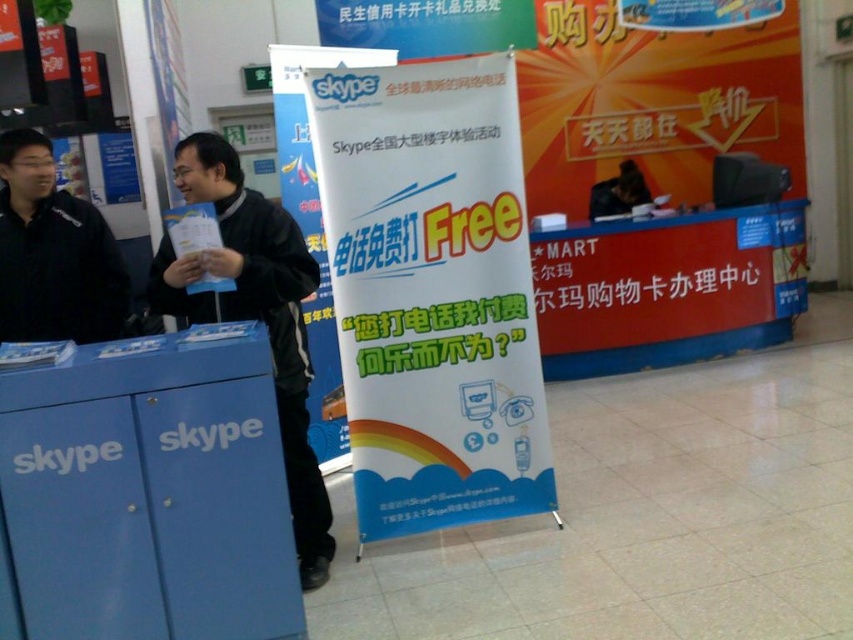
Question: Does red plastic sign at center have a smaller size compared to black matte jacket at left?

Choices:
 (A) yes
 (B) no

Answer: (B)

Question: Which object is the farthest from the white paper sign at center?

Choices:
 (A) blue matte skype cabinet at left
 (B) red plastic sign at center
 (C) black matte jacket at center
 (D) black matte jacket at left

Answer: (B)

Question: Based on their relative distances, which object is nearer to the black matte jacket at center?

Choices:
 (A) black matte jacket at left
 (B) red plastic sign at center

Answer: (A)

Question: Can you confirm if white paper sign at center is bigger than black matte jacket at center?

Choices:
 (A) yes
 (B) no

Answer: (A)

Question: Is blue matte skype cabinet at left to the left of black matte jacket at center from the viewer's perspective?

Choices:
 (A) yes
 (B) no

Answer: (A)

Question: Among these points, which one is nearest to the camera?

Choices:
 (A) (444, 412)
 (B) (233, 250)
 (C) (538, 310)
 (D) (90, 531)

Answer: (D)